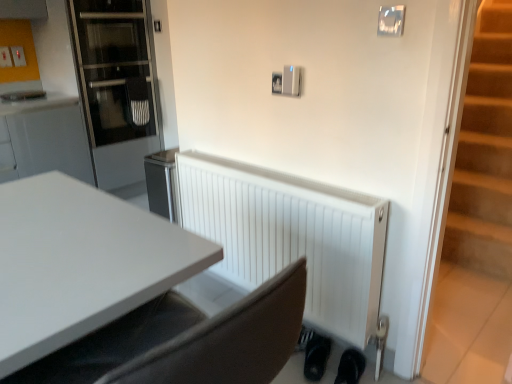
Question: Does black matte shoe at lower right, the second shoe positioned from the right, lie behind white matte radiator at lower center?

Choices:
 (A) yes
 (B) no

Answer: (A)

Question: Is black matte shoe at lower right, the second shoe positioned from the right, to the left of white matte radiator at lower center from the viewer's perspective?

Choices:
 (A) yes
 (B) no

Answer: (B)

Question: Is black matte shoe at lower right, positioned as the 1th shoe in left-to-right order, in front of white matte radiator at lower center?

Choices:
 (A) no
 (B) yes

Answer: (A)

Question: Is black matte shoe at lower right, positioned as the 1th shoe in left-to-right order, to the right of white matte radiator at lower center from the viewer's perspective?

Choices:
 (A) yes
 (B) no

Answer: (A)

Question: From the image's perspective, is black matte shoe at lower right, the second shoe positioned from the right, on white matte radiator at lower center?

Choices:
 (A) no
 (B) yes

Answer: (A)

Question: From a real-world perspective, is black matte shoe at lower right, the second shoe positioned from the right, on top of white matte radiator at lower center?

Choices:
 (A) no
 (B) yes

Answer: (A)

Question: Considering the relative sizes of transparent glass door at left and white matte radiator at lower center in the image provided, is transparent glass door at left taller than white matte radiator at lower center?

Choices:
 (A) no
 (B) yes

Answer: (B)

Question: Would you say transparent glass door at left is outside white matte radiator at lower center?

Choices:
 (A) no
 (B) yes

Answer: (B)

Question: Considering the relative sizes of transparent glass door at left and white matte radiator at lower center in the image provided, is transparent glass door at left smaller than white matte radiator at lower center?

Choices:
 (A) yes
 (B) no

Answer: (B)

Question: Is transparent glass door at left to the right of white matte radiator at lower center from the viewer's perspective?

Choices:
 (A) yes
 (B) no

Answer: (B)

Question: Is transparent glass door at left turned away from white matte radiator at lower center?

Choices:
 (A) no
 (B) yes

Answer: (A)

Question: Can you confirm if transparent glass door at left is bigger than white matte radiator at lower center?

Choices:
 (A) yes
 (B) no

Answer: (A)

Question: Can you confirm if black rubber shoe at lower right, which appears as the second shoe when viewed from the left, is wider than black matte shoe at lower right, the second shoe positioned from the right?

Choices:
 (A) yes
 (B) no

Answer: (B)